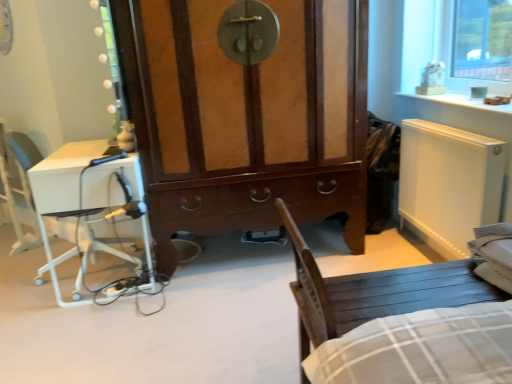
Question: Is white glossy desk at left spatially inside brown wood cabinet at center, or outside of it?

Choices:
 (A) outside
 (B) inside

Answer: (A)

Question: From the image's perspective, is white glossy desk at left positioned above or below brown wood cabinet at center?

Choices:
 (A) above
 (B) below

Answer: (B)

Question: Based on their relative distances, which object is farther from the white matte radiator at right?

Choices:
 (A) brown wood cabinet at center
 (B) white plastic armchair at left
 (C) white glossy desk at left
 (D) wooden chair at lower right

Answer: (B)

Question: Considering the real-world distances, which object is farthest from the white glossy desk at left?

Choices:
 (A) brown wood cabinet at center
 (B) wooden chair at lower right
 (C) white matte radiator at right
 (D) white plastic armchair at left

Answer: (C)